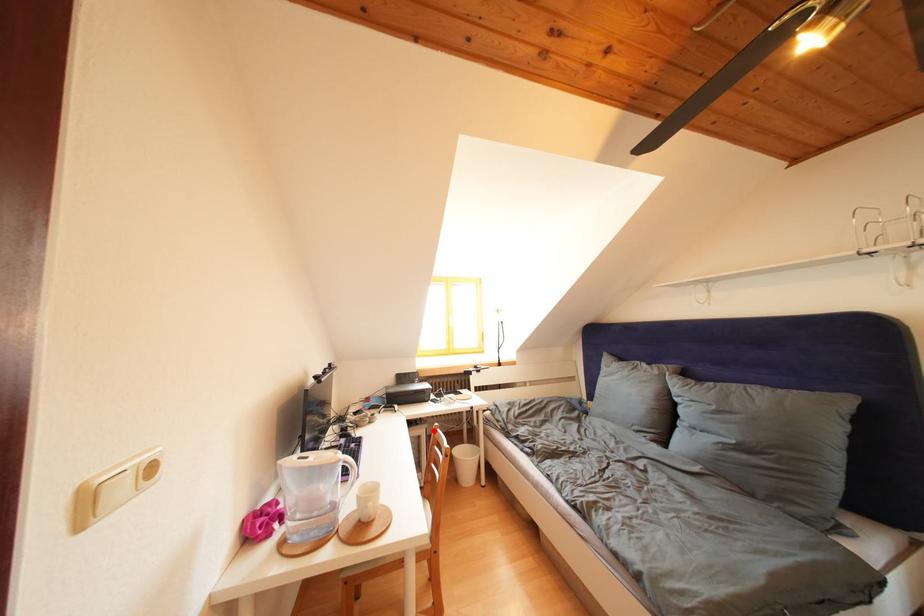
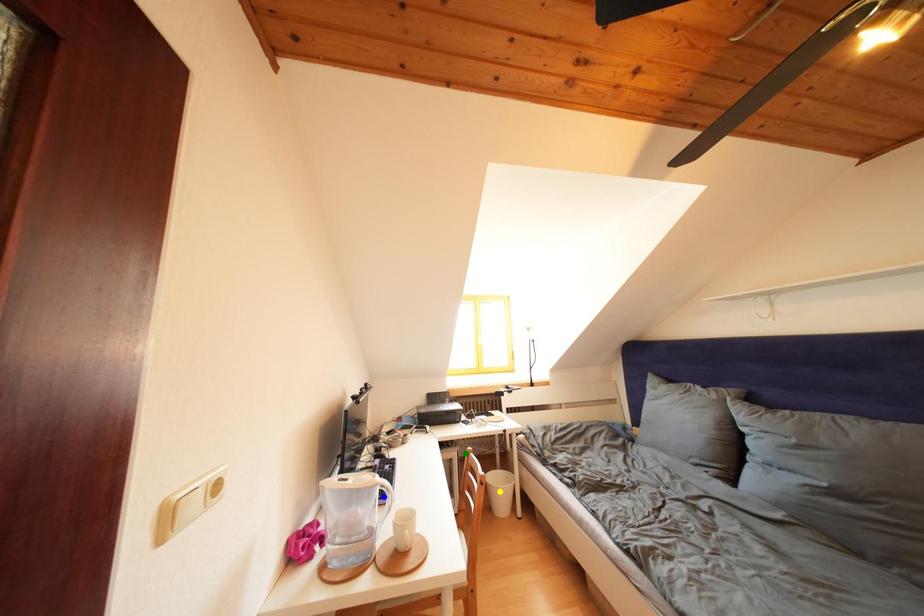
Question: I am providing you with two images of the same scene from different viewpoints. A red point is marked on the first image. You are given multiple points on the second image. Which point in image 2 represents the same 3d spot as the red point in image 1?

Choices:
 (A) yellow point
 (B) green point
 (C) blue point

Answer: (B)